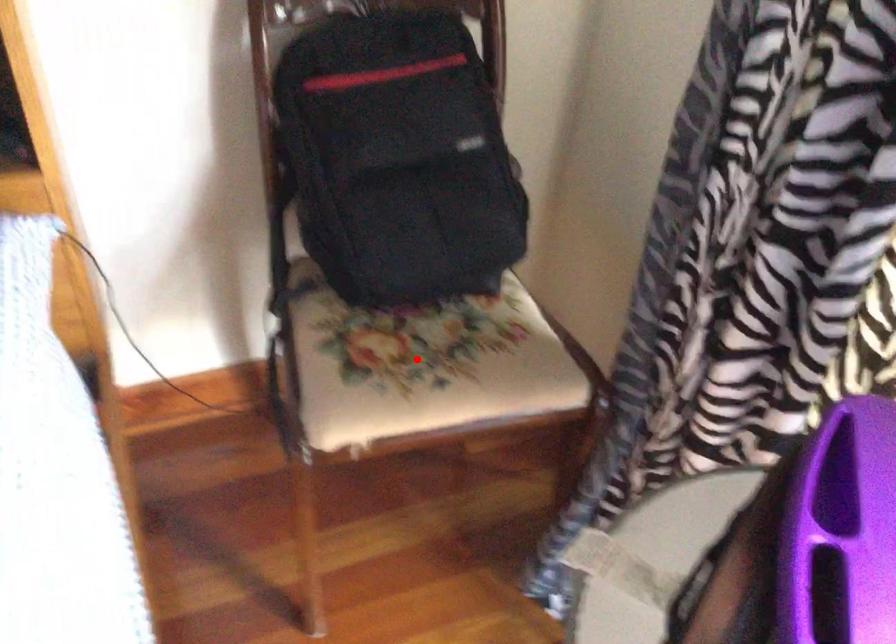
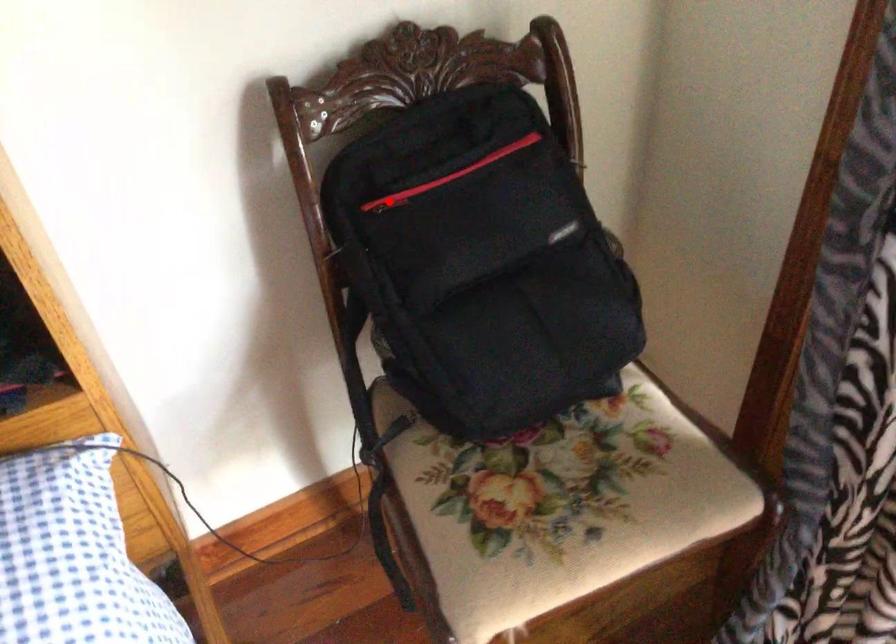
I am providing you with two images of the same scene from different viewpoints. A red point is marked on the first image and another point is marked on the second image. Is the red point in image1 aligned with the point shown in image2?

No